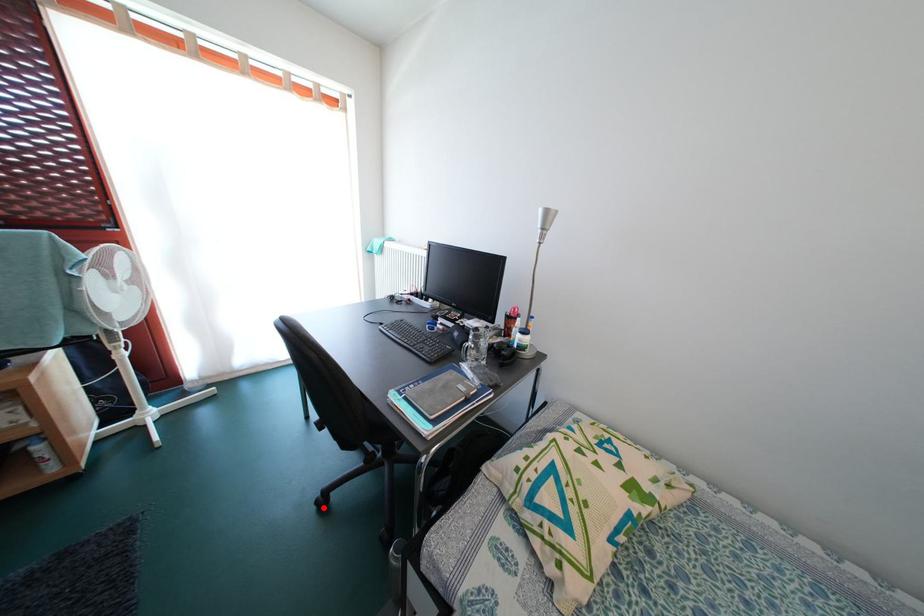
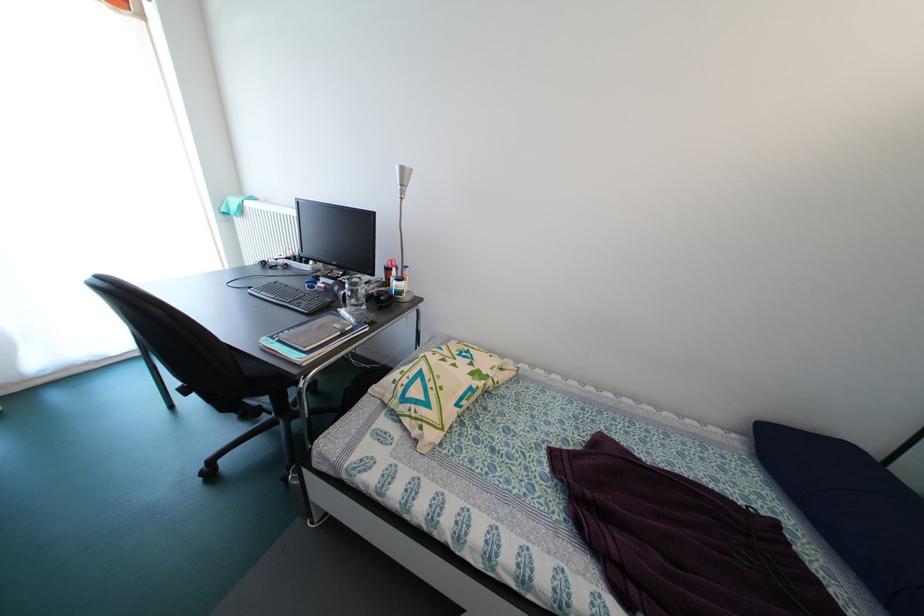
Question: I am providing you with two images of the same scene from different viewpoints. In image1, a red point is highlighted. Considering the same 3D point in image2, which of the following is correct?

Choices:
 (A) It is closer
 (B) It is farther

Answer: (A)